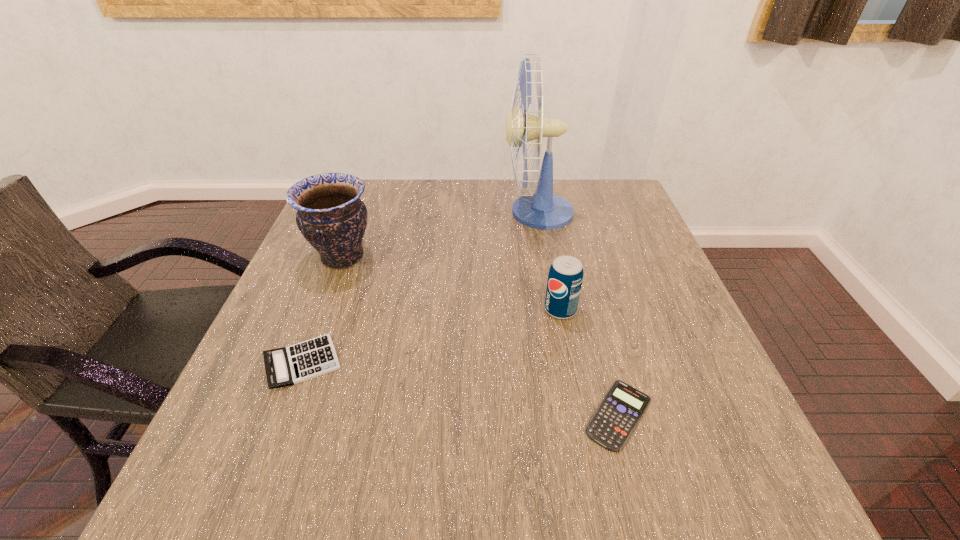
At what (x,y) coordinates should I click in order to perform the action: click on fan. Please return your answer as a coordinate pair (x, y). Looking at the image, I should click on (542, 210).

Find the location of a particular element. pottery is located at coordinates (331, 216).

Locate an element on the screen. the third nearest object is located at coordinates (565, 277).

The height and width of the screenshot is (540, 960). In order to click on pop in this screenshot , I will do `click(565, 277)`.

Where is `the left calculator`? Image resolution: width=960 pixels, height=540 pixels. the left calculator is located at coordinates (286, 366).

The image size is (960, 540). What are the coordinates of `the taller calculator` in the screenshot? It's located at (286, 366).

In order to click on the shortest object in this screenshot , I will do `click(611, 426)`.

This screenshot has width=960, height=540. Find the location of `the shorter calculator`. the shorter calculator is located at coordinates (611, 426).

The width and height of the screenshot is (960, 540). In order to click on vacant region located at the front of the fan where the blades are visible in this screenshot , I will do `click(361, 213)`.

Identify the location of vacant space located 0.100m at the front of the fan where the blades are visible. (468, 213).